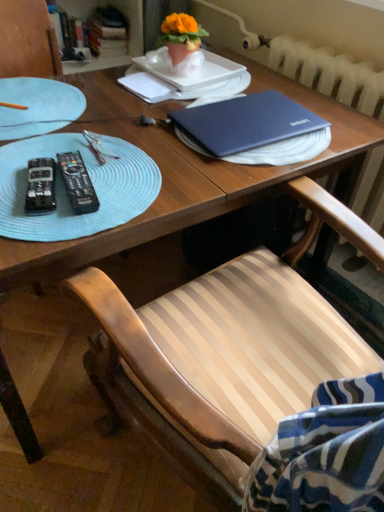
Where is `vacant area that is situated to the right of orange matte flower pot at upper center`? vacant area that is situated to the right of orange matte flower pot at upper center is located at coordinates (223, 70).